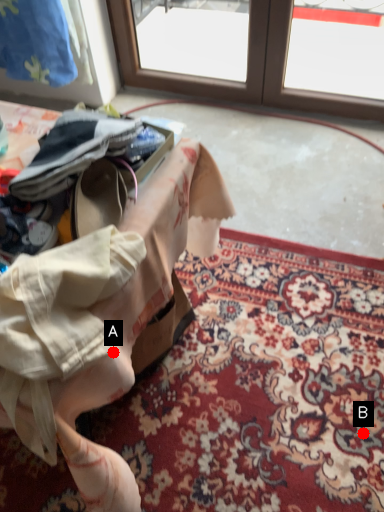
Question: Two points are circled on the image, labeled by A and B beside each circle. Which point is closer to the camera?

Choices:
 (A) A is closer
 (B) B is closer

Answer: (A)